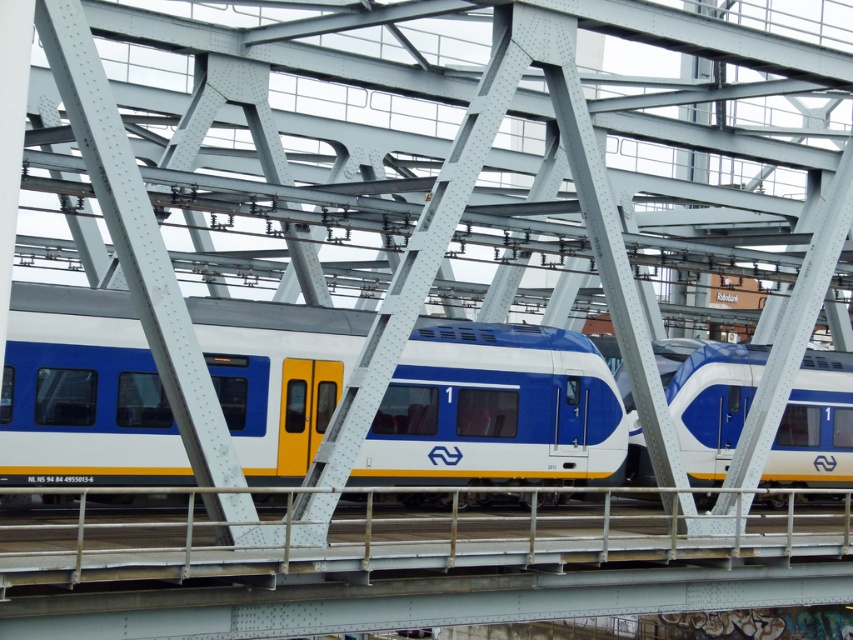
You are a photographer trying to capture the train on the bridge. You have a camera with a fixed width of 1.5 meters. The matte blue and white train at center and the blue glossy train at center are both on the bridge. Which train would require a wider frame to fully capture in your photo?

The matte blue and white train at center requires a wider frame because its width surpasses that of the blue glossy train at center.

Based on the photo, you are a photographer standing on the platform next to the steel bridge. You want to take a photo of both the matte blue and white train at center and the blue glossy train at center. Which train will appear larger in the photo?

The matte blue and white train at center will appear larger in the photo because it has a larger size compared to the blue glossy train at center.

You are a passenger on the matte blue and white train at center and the blue glossy train at center. You notice that both trains are on the same track. Which train is closer to the bridge you are about to cross?

The matte blue and white train at center is closer to the bridge because it is positioned in front of the blue glossy train at center, meaning it is ahead on the track towards the bridge.